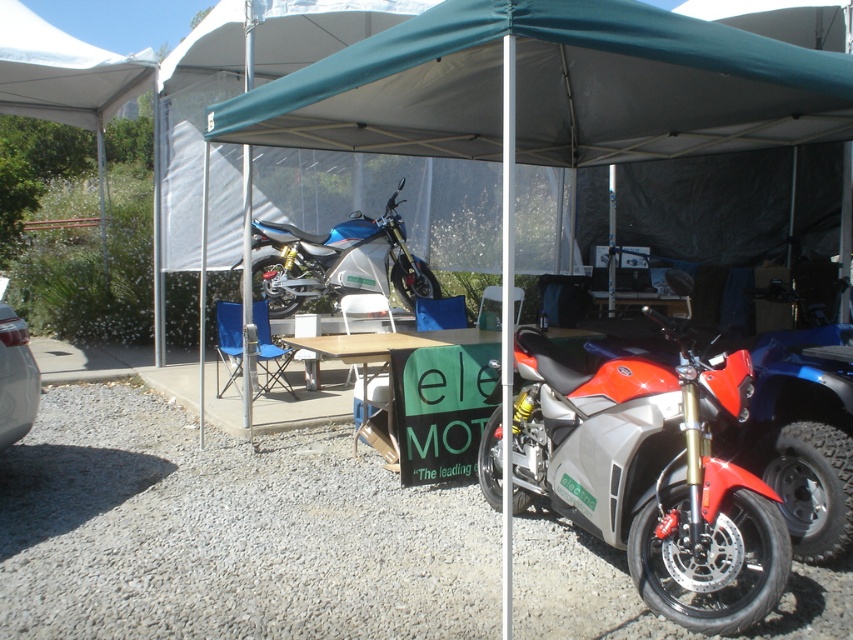
Describe the element at coordinates (339, 262) in the screenshot. The image size is (853, 640). I see `blue metallic motorcycle at center` at that location.

Between blue metallic motorcycle at center and metallic silver car at lower left, which one is positioned lower?

metallic silver car at lower left is lower down.

Who is more distant from viewer, (276, 282) or (0, 314)?

The point (276, 282) is more distant.

Image resolution: width=853 pixels, height=640 pixels. Find the location of `blue metallic motorcycle at center`. blue metallic motorcycle at center is located at coordinates (339, 262).

Who is shorter, matte silver motorcycle at center or blue metallic motorcycle at center?

With less height is blue metallic motorcycle at center.

Can you confirm if matte silver motorcycle at center is wider than blue metallic motorcycle at center?

No.

Who is more forward, (705, 452) or (428, 280)?

Point (705, 452) is more forward.

This screenshot has height=640, width=853. In order to click on matte silver motorcycle at center in this screenshot , I will do `click(653, 476)`.

Is blue metallic motorcycle at center positioned behind wooden table at center?

Yes, blue metallic motorcycle at center is behind wooden table at center.

Between blue metallic motorcycle at center and wooden table at center, which one appears on the right side from the viewer's perspective?

From the viewer's perspective, wooden table at center appears more on the right side.

Does point (349, 288) lie in front of point (351, 355)?

No, (349, 288) is further to viewer.

The image size is (853, 640). What are the coordinates of `blue metallic motorcycle at center` in the screenshot? It's located at (339, 262).